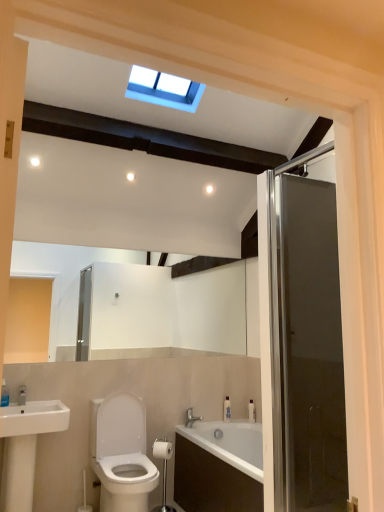
Question: Would you say white glossy sink at lower left contains white glossy bottle at lower center, acting as the 2th toiletry starting from the right?

Choices:
 (A) no
 (B) yes

Answer: (A)

Question: From a real-world perspective, does white glossy sink at lower left sit lower than white glossy bottle at lower center, positioned as the first toiletry in left-to-right order?

Choices:
 (A) no
 (B) yes

Answer: (B)

Question: Is white glossy sink at lower left bigger than white glossy bottle at lower center, positioned as the first toiletry in left-to-right order?

Choices:
 (A) yes
 (B) no

Answer: (A)

Question: Does white glossy sink at lower left have a smaller size compared to white glossy bottle at lower center, positioned as the first toiletry in left-to-right order?

Choices:
 (A) no
 (B) yes

Answer: (A)

Question: Does white glossy sink at lower left turn towards white glossy bottle at lower center, positioned as the first toiletry in left-to-right order?

Choices:
 (A) yes
 (B) no

Answer: (B)

Question: Does white glossy sink at lower left lie behind white glossy bottle at lower center, acting as the 2th toiletry starting from the right?

Choices:
 (A) yes
 (B) no

Answer: (B)

Question: Can you confirm if silver metallic faucet at lower center is taller than silver metallic toilet paper holder at lower center, the second towel bar positioned from the bottom?

Choices:
 (A) no
 (B) yes

Answer: (B)

Question: Is silver metallic faucet at lower center outside of silver metallic toilet paper holder at lower center, the second towel bar positioned from the bottom?

Choices:
 (A) yes
 (B) no

Answer: (A)

Question: Is silver metallic faucet at lower center bigger than silver metallic toilet paper holder at lower center, the second towel bar positioned from the bottom?

Choices:
 (A) yes
 (B) no

Answer: (B)

Question: From a real-world perspective, is silver metallic faucet at lower center below silver metallic toilet paper holder at lower center, marked as the first towel bar in a top-to-bottom arrangement?

Choices:
 (A) yes
 (B) no

Answer: (B)

Question: Would you say silver metallic toilet paper holder at lower center, the second towel bar positioned from the bottom, is part of silver metallic faucet at lower center's contents?

Choices:
 (A) no
 (B) yes

Answer: (A)

Question: Does silver metallic faucet at lower center appear on the right side of silver metallic toilet paper holder at lower center, the second towel bar positioned from the bottom?

Choices:
 (A) no
 (B) yes

Answer: (B)

Question: Is white plastic bottle at right, the 2th toiletry viewed from the left, taller than white glossy toilet at lower left?

Choices:
 (A) yes
 (B) no

Answer: (B)